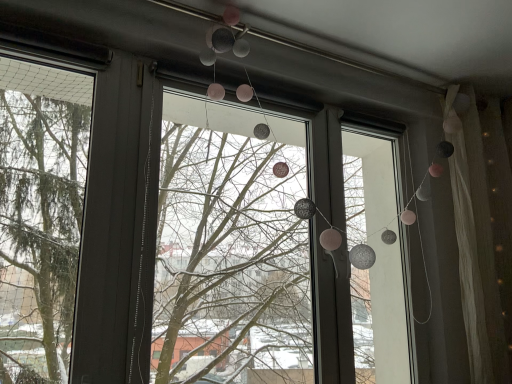
Identify the location of translucent white curtain at right. Image resolution: width=512 pixels, height=384 pixels. 473,236.

This screenshot has width=512, height=384. Describe the element at coordinates (473, 236) in the screenshot. I see `translucent white curtain at right` at that location.

The image size is (512, 384). I want to click on translucent glass window at upper center, so click(231, 246).

The height and width of the screenshot is (384, 512). What do you see at coordinates (231, 246) in the screenshot?
I see `translucent glass window at upper center` at bounding box center [231, 246].

What are the coordinates of `translucent white curtain at right` in the screenshot? It's located at (473, 236).

Is translucent white curtain at right to the left or to the right of translucent glass window at upper center in the image?

From the image, it's evident that translucent white curtain at right is to the right of translucent glass window at upper center.

Which object is more forward, translucent white curtain at right or translucent glass window at upper center?

Positioned in front is translucent glass window at upper center.

Does point (490, 379) appear closer or farther from the camera than point (290, 314)?

Point (490, 379) is closer to the camera than point (290, 314).

From the image's perspective, is translucent white curtain at right located beneath translucent glass window at upper center?

Indeed, from the image's perspective, translucent white curtain at right is shown beneath translucent glass window at upper center.

From a real-world perspective, which is physically above, translucent white curtain at right or translucent glass window at upper center?

translucent white curtain at right.

Which object is wider, translucent white curtain at right or translucent glass window at upper center?

translucent white curtain at right.

Considering the sizes of objects translucent white curtain at right and translucent glass window at upper center in the image provided, who is shorter, translucent white curtain at right or translucent glass window at upper center?

Standing shorter between the two is translucent glass window at upper center.

Considering the sizes of objects translucent white curtain at right and translucent glass window at upper center in the image provided, who is bigger, translucent white curtain at right or translucent glass window at upper center?

translucent glass window at upper center is bigger.

Do you think translucent white curtain at right is within translucent glass window at upper center, or outside of it?

translucent white curtain at right is not enclosed by translucent glass window at upper center.

Are translucent white curtain at right and translucent glass window at upper center far apart?

Absolutely, translucent white curtain at right is distant from translucent glass window at upper center.

Is translucent white curtain at right facing away from translucent glass window at upper center?

translucent white curtain at right does not have its back to translucent glass window at upper center.

Identify the location of curtain behind the translucent glass window at upper center. (473, 236).

Considering the positions of objects translucent glass window at upper center and translucent white curtain at right in the image provided, who is more to the left, translucent glass window at upper center or translucent white curtain at right?

translucent glass window at upper center.

Is translucent glass window at upper center positioned behind translucent white curtain at right?

That is False.

Is point (292, 192) in front of point (467, 187)?

No, (292, 192) is further to viewer.

From the image's perspective, between translucent glass window at upper center and translucent white curtain at right, who is located below?

translucent white curtain at right is shown below in the image.

From a real-world perspective, which object stands above the other?

In real-world perspective, translucent white curtain at right is above.

Is translucent glass window at upper center wider than translucent white curtain at right?

No.

Is translucent glass window at upper center taller than translucent white curtain at right?

No.

Who is bigger, translucent glass window at upper center or translucent white curtain at right?

translucent glass window at upper center is bigger.

Would you say translucent glass window at upper center is inside or outside translucent white curtain at right?

translucent glass window at upper center exists outside the volume of translucent white curtain at right.

Are translucent glass window at upper center and translucent white curtain at right beside each other?

No, translucent glass window at upper center is not touching translucent white curtain at right.

Is translucent glass window at upper center aimed at translucent white curtain at right?

No, translucent glass window at upper center is not facing towards translucent white curtain at right.

The width and height of the screenshot is (512, 384). What are the coordinates of `shop window located underneath the translucent white curtain at right (from a real-world perspective)` in the screenshot? It's located at (231, 246).

At what (x,y) coordinates should I click in order to perform the action: click on curtain to the right of translucent glass window at upper center. Please return your answer as a coordinate pair (x, y). Looking at the image, I should click on (473, 236).

I want to click on shop window on the left side of translucent white curtain at right, so click(231, 246).